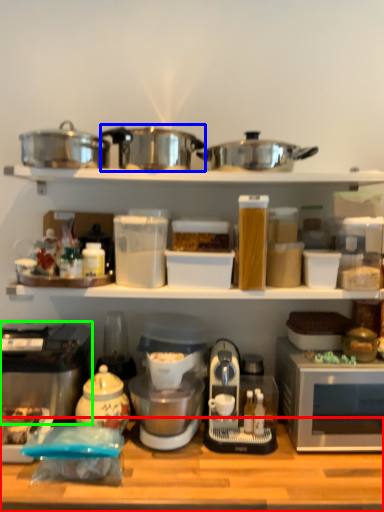
Question: Which object is the closest to the table (highlighted by a red box)? Choose among these: crock pot (highlighted by a blue box) or home appliance (highlighted by a green box).

Choices:
 (A) crock pot
 (B) home appliance

Answer: (B)